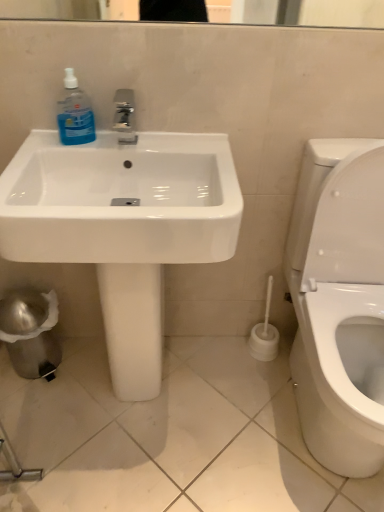
What is the approximate height of blue translucent liquid at sink left?

7.43 inches.

This screenshot has width=384, height=512. What do you see at coordinates (75, 114) in the screenshot?
I see `blue translucent liquid at sink left` at bounding box center [75, 114].

Identify the location of blue translucent liquid at sink left. (75, 114).

The image size is (384, 512). What do you see at coordinates (123, 226) in the screenshot? I see `white glossy sink at center` at bounding box center [123, 226].

Where is `white glossy sink at center`? white glossy sink at center is located at coordinates (123, 226).

Find the location of a particular element. blue translucent liquid at sink left is located at coordinates tap(75, 114).

Is blue translucent liquid at sink left at the left side of white glossy sink at center?

Yes.

Which is behind, blue translucent liquid at sink left or white glossy sink at center?

Positioned behind is blue translucent liquid at sink left.

Does point (66, 99) come closer to viewer compared to point (126, 264)?

No, (66, 99) is behind (126, 264).

From the image's perspective, between blue translucent liquid at sink left and white glossy sink at center, which one is located above?

blue translucent liquid at sink left is shown above in the image.

In the scene shown: From a real-world perspective, is blue translucent liquid at sink left below white glossy sink at center?

No, from a real-world perspective, blue translucent liquid at sink left is not under white glossy sink at center.

Which of these two, blue translucent liquid at sink left or white glossy sink at center, is thinner?

blue translucent liquid at sink left.

Looking at this image, can you confirm if blue translucent liquid at sink left is taller than white glossy sink at center?

No, blue translucent liquid at sink left is not taller than white glossy sink at center.

Which of these two, blue translucent liquid at sink left or white glossy sink at center, is smaller?

blue translucent liquid at sink left.

Is blue translucent liquid at sink left not within white glossy sink at center?

Actually, blue translucent liquid at sink left is within white glossy sink at center.

Are blue translucent liquid at sink left and white glossy sink at center far apart?

Actually, blue translucent liquid at sink left and white glossy sink at center are a little close together.

Is blue translucent liquid at sink left oriented away from white glossy sink at center?

Correct, blue translucent liquid at sink left is looking away from white glossy sink at center.

How distant is blue translucent liquid at sink left from white glossy sink at center?

12.51 inches.

The width and height of the screenshot is (384, 512). I want to click on cleaning product behind the white glossy sink at center, so pyautogui.click(x=75, y=114).

Is white glossy sink at center to the left of blue translucent liquid at sink left from the viewer's perspective?

Incorrect, white glossy sink at center is not on the left side of blue translucent liquid at sink left.

Is white glossy sink at center further to camera compared to blue translucent liquid at sink left?

No, white glossy sink at center is closer to the camera.

Is point (155, 140) more distant than point (65, 126)?

Yes, point (155, 140) is behind point (65, 126).

From the image's perspective, between white glossy sink at center and blue translucent liquid at sink left, which one is located above?

blue translucent liquid at sink left, from the image's perspective.

From a real-world perspective, which object stands above the other?

blue translucent liquid at sink left, from a real-world perspective.

Which of these two, white glossy sink at center or blue translucent liquid at sink left, is thinner?

Thinner between the two is blue translucent liquid at sink left.

From their relative heights in the image, would you say white glossy sink at center is taller or shorter than blue translucent liquid at sink left?

Considering their sizes, white glossy sink at center has more height than blue translucent liquid at sink left.

Consider the image. Between white glossy sink at center and blue translucent liquid at sink left, which one has larger size?

white glossy sink at center.

Is blue translucent liquid at sink left surrounded by white glossy sink at center?

Yes, blue translucent liquid at sink left is inside white glossy sink at center.

Is white glossy sink at center touching blue translucent liquid at sink left?

white glossy sink at center and blue translucent liquid at sink left are clearly separated.

Could you tell me if white glossy sink at center is turned towards blue translucent liquid at sink left?

No, white glossy sink at center does not turn towards blue translucent liquid at sink left.

What's the angular difference between white glossy sink at center and blue translucent liquid at sink left's facing directions?

They differ by 1.21 degrees in their facing directions.

Where is `cleaning product above the white glossy sink at center (from a real-world perspective)`? The height and width of the screenshot is (512, 384). cleaning product above the white glossy sink at center (from a real-world perspective) is located at coordinates (75, 114).

Where is `sink that is under the blue translucent liquid at sink left (from a real-world perspective)`? sink that is under the blue translucent liquid at sink left (from a real-world perspective) is located at coordinates (123, 226).

Locate an element on the screen. sink in front of the blue translucent liquid at sink left is located at coordinates (123, 226).